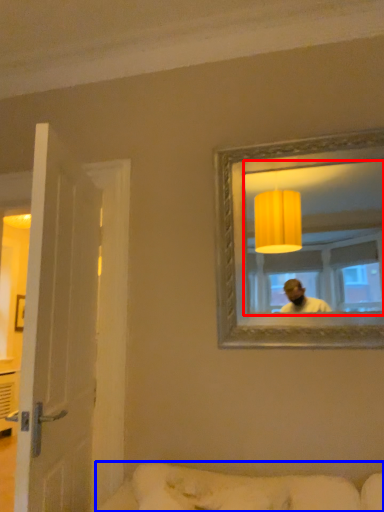
Question: Among these objects, which one is farthest to the camera, mirror (highlighted by a red box) or studio couch (highlighted by a blue box)?

Choices:
 (A) mirror
 (B) studio couch

Answer: (A)